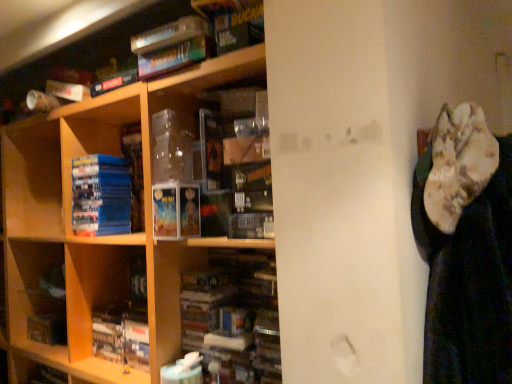
The height and width of the screenshot is (384, 512). What do you see at coordinates (176, 211) in the screenshot?
I see `matte paperbacks at center` at bounding box center [176, 211].

Measure the distance between blue matte book at left, marked as the 2th book in a bottom-to-top arrangement, and camera.

blue matte book at left, marked as the 2th book in a bottom-to-top arrangement, is 5.02 feet away from camera.

This screenshot has width=512, height=384. Identify the location of hardcover book at center, acting as the 1th book starting from the bottom. (125, 324).

Image resolution: width=512 pixels, height=384 pixels. I want to click on matte paperbacks at center, so click(176, 211).

Considering their positions, is hardcover book at center, acting as the 1th book starting from the bottom, located in front of or behind wooden shelf at center?

hardcover book at center, acting as the 1th book starting from the bottom, is behind wooden shelf at center.

Can you confirm if hardcover book at center, acting as the 1th book starting from the bottom, is taller than wooden shelf at center?

No, hardcover book at center, acting as the 1th book starting from the bottom, is not taller than wooden shelf at center.

What's the angular difference between hardcover book at center, acting as the 1th book starting from the bottom, and wooden shelf at center's facing directions?

0.329 degrees.

Considering the relative positions of hardcover book at center, acting as the 1th book starting from the bottom, and wooden shelf at center in the image provided, is hardcover book at center, acting as the 1th book starting from the bottom, to the right of wooden shelf at center from the viewer's perspective?

Yes.

From a real-world perspective, relative to matte paperbacks at center, is blue matte book at left, which is counted as the first book, starting from the top, vertically above or below?

blue matte book at left, which is counted as the first book, starting from the top, is above matte paperbacks at center.

Considering the sizes of objects blue matte book at left, marked as the 2th book in a bottom-to-top arrangement, and matte paperbacks at center in the image provided, who is wider, blue matte book at left, marked as the 2th book in a bottom-to-top arrangement, or matte paperbacks at center?

blue matte book at left, marked as the 2th book in a bottom-to-top arrangement, is wider.

Is blue matte book at left, marked as the 2th book in a bottom-to-top arrangement, further to camera compared to matte paperbacks at center?

Yes, blue matte book at left, marked as the 2th book in a bottom-to-top arrangement, is further from the viewer.

From the picture: Can you confirm if blue matte book at left, marked as the 2th book in a bottom-to-top arrangement, is shorter than matte paperbacks at center?

Incorrect, the height of blue matte book at left, marked as the 2th book in a bottom-to-top arrangement, does not fall short of that of matte paperbacks at center.

Is blue matte book at left, marked as the 2th book in a bottom-to-top arrangement, positioned behind wooden shelf at center?

Yes, it is.

Which of these two, blue matte book at left, which is counted as the first book, starting from the top, or wooden shelf at center, stands taller?

→ With more height is wooden shelf at center.

Between blue matte book at left, marked as the 2th book in a bottom-to-top arrangement, and wooden shelf at center, which one appears on the left side from the viewer's perspective?

wooden shelf at center is more to the left.

Looking at this image, from the image's perspective, is blue matte book at left, which is counted as the first book, starting from the top, located above wooden shelf at center?

Correct, blue matte book at left, which is counted as the first book, starting from the top, appears higher than wooden shelf at center in the image.

Where is `book lying in front of the hardcover book at center, placed as the 2th book when sorted from top to bottom`? book lying in front of the hardcover book at center, placed as the 2th book when sorted from top to bottom is located at coordinates (101, 195).

Is hardcover book at center, acting as the 1th book starting from the bottom, facing away from blue matte book at left, which is counted as the first book, starting from the top?

hardcover book at center, acting as the 1th book starting from the bottom, does not have its back to blue matte book at left, which is counted as the first book, starting from the top.

Is hardcover book at center, acting as the 1th book starting from the bottom, situated inside blue matte book at left, marked as the 2th book in a bottom-to-top arrangement, or outside?

The correct answer is: outside.

From a real-world perspective, between hardcover book at center, placed as the 2th book when sorted from top to bottom, and blue matte book at left, which is counted as the first book, starting from the top, who is vertically lower?

hardcover book at center, placed as the 2th book when sorted from top to bottom, from a real-world perspective.

Who is shorter, matte paperbacks at center or wooden shelf at center?

matte paperbacks at center is shorter.

Considering their positions, is matte paperbacks at center located in front of or behind wooden shelf at center?

Visually, matte paperbacks at center is located behind wooden shelf at center.

From the image's perspective, is matte paperbacks at center located beneath wooden shelf at center?

No.

From a real-world perspective, relative to wooden shelf at center, is matte paperbacks at center vertically above or below?

From a real-world perspective, matte paperbacks at center is physically above wooden shelf at center.

Does matte paperbacks at center have a greater width compared to hardcover book at center, acting as the 1th book starting from the bottom?

Correct, the width of matte paperbacks at center exceeds that of hardcover book at center, acting as the 1th book starting from the bottom.

Could you tell me if matte paperbacks at center is turned towards hardcover book at center, placed as the 2th book when sorted from top to bottom?

No.

Which object is positioned more to the left, matte paperbacks at center or hardcover book at center, acting as the 1th book starting from the bottom?

Positioned to the left is hardcover book at center, acting as the 1th book starting from the bottom.

How different are the orientations of matte paperbacks at center and hardcover book at center, placed as the 2th book when sorted from top to bottom, in degrees?

The angle between the facing direction of matte paperbacks at center and the facing direction of hardcover book at center, placed as the 2th book when sorted from top to bottom, is 0.000609 degrees.

In the scene shown: Is wooden shelf at center placed right next to matte paperbacks at center?

wooden shelf at center and matte paperbacks at center are not in contact.

In the image, is wooden shelf at center positioned in front of or behind matte paperbacks at center?

wooden shelf at center is in front of matte paperbacks at center.

At what (x,y) coordinates should I click in order to perform the action: click on paperback book that is above the wooden shelf at center (from a real-world perspective). Please return your answer as a coordinate pair (x, y). Looking at the image, I should click on (176, 211).

In the scene shown: Can you confirm if wooden shelf at center is thinner than matte paperbacks at center?

Incorrect, the width of wooden shelf at center is not less than that of matte paperbacks at center.

At what (x,y) coordinates should I click in order to perform the action: click on book below the wooden shelf at center (from the image's perspective). Please return your answer as a coordinate pair (x, y). The image size is (512, 384). Looking at the image, I should click on (125, 324).

Find the location of `book that appears above the matte paperbacks at center (from a real-world perspective)`. book that appears above the matte paperbacks at center (from a real-world perspective) is located at coordinates (101, 195).

Considering their positions, is wooden shelf at center positioned further to hardcover book at center, acting as the 1th book starting from the bottom, than matte paperbacks at center?

matte paperbacks at center lies further to hardcover book at center, acting as the 1th book starting from the bottom, than the other object.

From the image, which object appears to be nearer to wooden shelf at center, matte paperbacks at center or blue matte book at left, marked as the 2th book in a bottom-to-top arrangement?

blue matte book at left, marked as the 2th book in a bottom-to-top arrangement, is positioned closer to the anchor wooden shelf at center.

When comparing their distances from blue matte book at left, marked as the 2th book in a bottom-to-top arrangement, does matte paperbacks at center or hardcover book at center, placed as the 2th book when sorted from top to bottom, seem closer?

The object closer to blue matte book at left, marked as the 2th book in a bottom-to-top arrangement, is hardcover book at center, placed as the 2th book when sorted from top to bottom.

Which object lies nearer to the anchor point wooden shelf at center, blue matte book at left, which is counted as the first book, starting from the top, or hardcover book at center, placed as the 2th book when sorted from top to bottom?

Based on the image, blue matte book at left, which is counted as the first book, starting from the top, appears to be nearer to wooden shelf at center.

Estimate the real-world distances between objects in this image. Which object is further from matte paperbacks at center, hardcover book at center, placed as the 2th book when sorted from top to bottom, or wooden shelf at center?

wooden shelf at center lies further to matte paperbacks at center than the other object.

Which object lies further to the anchor point hardcover book at center, placed as the 2th book when sorted from top to bottom, wooden shelf at center or blue matte book at left, which is counted as the first book, starting from the top?

blue matte book at left, which is counted as the first book, starting from the top.

In the scene shown: Which object lies further to the anchor point blue matte book at left, which is counted as the first book, starting from the top, matte paperbacks at center or wooden shelf at center?

matte paperbacks at center is positioned further to the anchor blue matte book at left, which is counted as the first book, starting from the top.

Based on their spatial positions, is hardcover book at center, placed as the 2th book when sorted from top to bottom, or matte paperbacks at center closer to wooden shelf at center?

Among the two, hardcover book at center, placed as the 2th book when sorted from top to bottom, is located nearer to wooden shelf at center.

Where is `paperback book between blue matte book at left, which is counted as the first book, starting from the top, and hardcover book at center, placed as the 2th book when sorted from top to bottom, in the vertical direction`? The width and height of the screenshot is (512, 384). paperback book between blue matte book at left, which is counted as the first book, starting from the top, and hardcover book at center, placed as the 2th book when sorted from top to bottom, in the vertical direction is located at coordinates (176, 211).

What are the coordinates of `book between wooden shelf at center and hardcover book at center, placed as the 2th book when sorted from top to bottom, from front to back` in the screenshot? It's located at (101, 195).